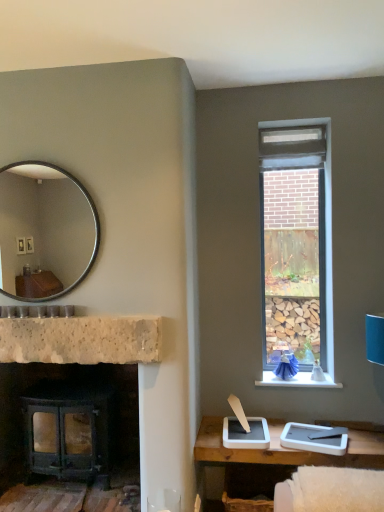
Question: Is matte black wood-burning stove at lower left wider than natural stone fireplace at center?

Choices:
 (A) yes
 (B) no

Answer: (A)

Question: Is matte black wood-burning stove at lower left smaller than natural stone fireplace at center?

Choices:
 (A) yes
 (B) no

Answer: (B)

Question: From a real-world perspective, is matte black wood-burning stove at lower left located higher than natural stone fireplace at center?

Choices:
 (A) yes
 (B) no

Answer: (B)

Question: From the image's perspective, is matte black wood-burning stove at lower left beneath natural stone fireplace at center?

Choices:
 (A) no
 (B) yes

Answer: (B)

Question: Would you say matte black wood-burning stove at lower left contains natural stone fireplace at center?

Choices:
 (A) yes
 (B) no

Answer: (B)

Question: Is silver metallic mirror at upper left taller or shorter than white stone window sill at upper right?

Choices:
 (A) short
 (B) tall

Answer: (B)

Question: Is silver metallic mirror at upper left in front of or behind white stone window sill at upper right in the image?

Choices:
 (A) front
 (B) behind

Answer: (A)

Question: Do you think silver metallic mirror at upper left is within white stone window sill at upper right, or outside of it?

Choices:
 (A) outside
 (B) inside

Answer: (A)

Question: Looking at the image, does silver metallic mirror at upper left seem bigger or smaller compared to white stone window sill at upper right?

Choices:
 (A) small
 (B) big

Answer: (B)

Question: Looking at the image, does white stone window sill at upper right seem bigger or smaller compared to matte black wood-burning stove at lower left?

Choices:
 (A) small
 (B) big

Answer: (A)

Question: Choose the correct answer: Is white stone window sill at upper right inside matte black wood-burning stove at lower left or outside it?

Choices:
 (A) outside
 (B) inside

Answer: (A)

Question: From the image's perspective, is white stone window sill at upper right located above or below matte black wood-burning stove at lower left?

Choices:
 (A) below
 (B) above

Answer: (B)

Question: From their relative heights in the image, would you say white stone window sill at upper right is taller or shorter than matte black wood-burning stove at lower left?

Choices:
 (A) tall
 (B) short

Answer: (B)

Question: From a real-world perspective, is natural stone fireplace at center positioned above or below white stone window sill at upper right?

Choices:
 (A) above
 (B) below

Answer: (A)

Question: Would you say natural stone fireplace at center is to the left or to the right of white stone window sill at upper right in the picture?

Choices:
 (A) right
 (B) left

Answer: (B)